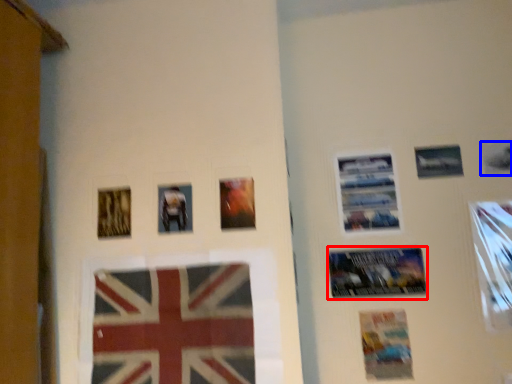
Question: Among these objects, which one is nearest to the camera, poster (highlighted by a red box) or picture frame (highlighted by a blue box)?

Choices:
 (A) poster
 (B) picture frame

Answer: (A)